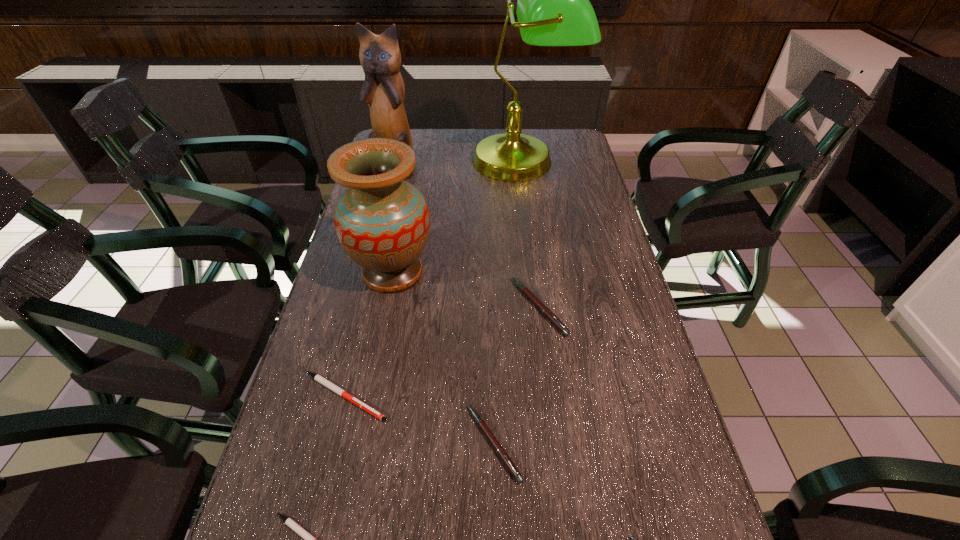
The height and width of the screenshot is (540, 960). I want to click on pink pen object that ranks as the second closest to the smaller white pen, so click(x=633, y=538).

You are a GUI agent. You are given a task and a screenshot of the screen. Output one action in this format:
    pyautogui.click(x=<x>, y=<y>)
    Task: Click on the white pen that is the second closest one to the farthest pink pen
    
    Given the screenshot: What is the action you would take?
    pyautogui.click(x=309, y=539)

This screenshot has width=960, height=540. What are the coordinates of `free spot that satisfies the following two spatial constraints: 1. on the desk next to the lamp; 2. at the nib of the second biggest pink pen` in the screenshot? It's located at (559, 443).

Locate an element on the screen. Image resolution: width=960 pixels, height=540 pixels. free space that satisfies the following two spatial constraints: 1. on the face of the second tallest object; 2. on the right side of the vase is located at coordinates (368, 273).